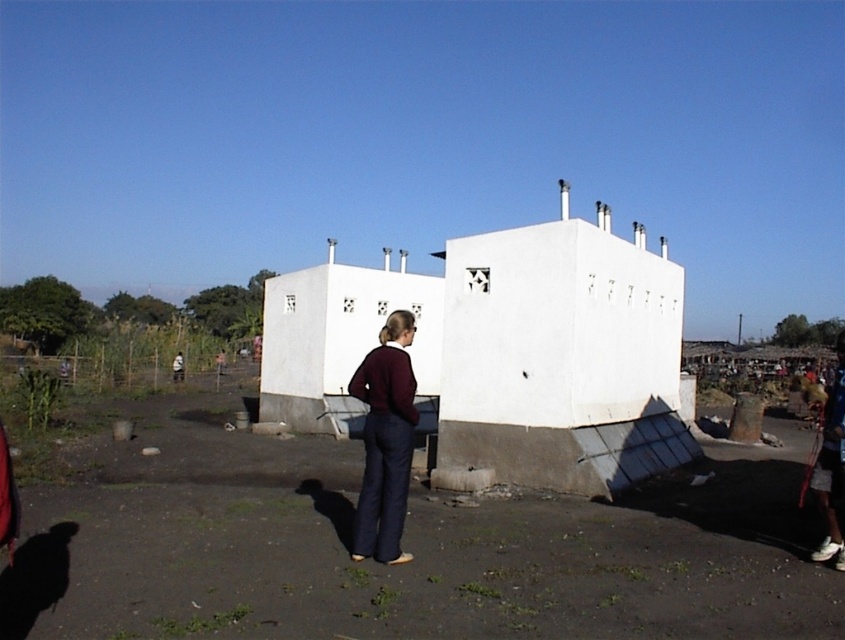
Which of these two, dirt field at lower center or brown leather jacket at center, stands shorter?

Standing shorter between the two is dirt field at lower center.

Looking at this image, who is more forward, (609, 566) or (177, 376)?

Point (609, 566)

You are a GUI agent. You are given a task and a screenshot of the screen. Output one action in this format:
    pyautogui.click(x=<x>, y=<y>)
    Task: Click on the dirt field at lower center
    This screenshot has width=845, height=640.
    Given the screenshot: What is the action you would take?
    pyautogui.click(x=407, y=548)

Which is more to the right, maroon sweater at center or brown leather jacket at center?

maroon sweater at center

Which is above, maroon sweater at center or brown leather jacket at center?

Positioned higher is maroon sweater at center.

Image resolution: width=845 pixels, height=640 pixels. In order to click on maroon sweater at center in this screenshot , I will do `click(385, 442)`.

Identify the location of maroon sweater at center. The height and width of the screenshot is (640, 845). (385, 442).

Is dirt field at lower center wider than maroon sweater at center?

Yes.

Who is higher up, dirt field at lower center or maroon sweater at center?

maroon sweater at center is higher up.

Find the location of a particular element. dirt field at lower center is located at coordinates (407, 548).